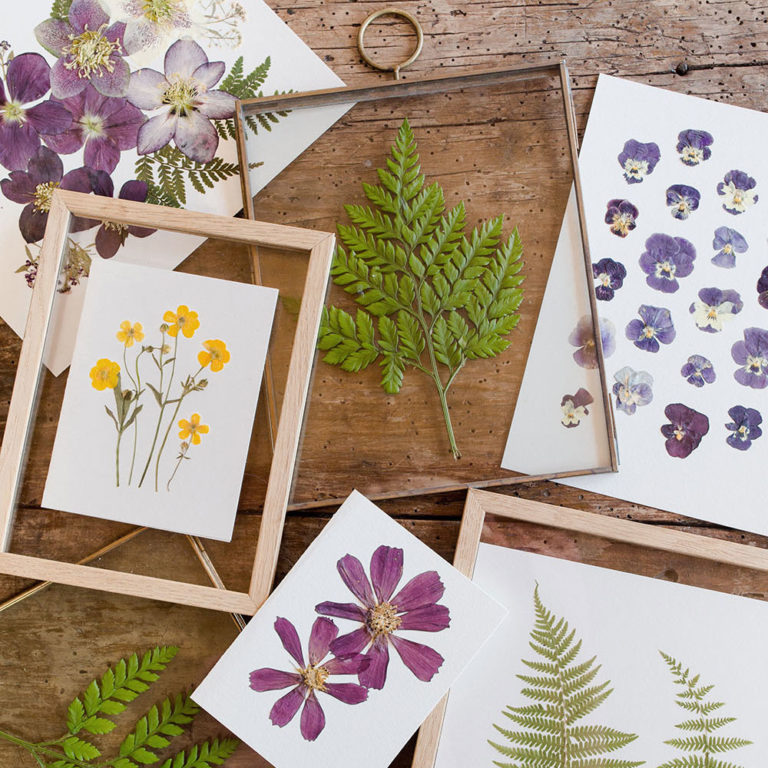
Where is `wooden table`? wooden table is located at coordinates (707, 51), (485, 41), (432, 511), (545, 540), (64, 535), (57, 617).